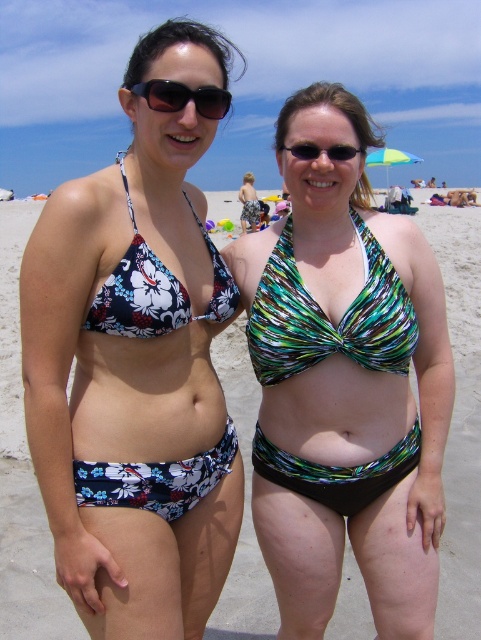
Question: Is green and black textured bikini top at center above floral print bikini top at center?

Choices:
 (A) yes
 (B) no

Answer: (B)

Question: Which of the following is the farthest from the observer?

Choices:
 (A) (407, 234)
 (B) (455, 228)

Answer: (B)

Question: Among these objects, which one is nearest to the camera?

Choices:
 (A) green and black textured bikini top at center
 (B) green and white printed bikini top at center
 (C) floral fabric bikini at center
 (D) multicolored bikini top at center

Answer: (C)

Question: Observing the image, what is the correct spatial positioning of green and white printed bikini top at center in reference to green and black textured bikini top at center?

Choices:
 (A) right
 (B) left

Answer: (A)

Question: Estimate the real-world distances between objects in this image. Which object is farther from the floral fabric bikini top at center?

Choices:
 (A) floral print bikini top at center
 (B) printed fabric bikini at center
 (C) floral fabric bikini at center
 (D) black plastic sunglasses at center

Answer: (B)

Question: Is floral fabric bikini top at center positioned at the back of black plastic sunglasses at center?

Choices:
 (A) no
 (B) yes

Answer: (A)